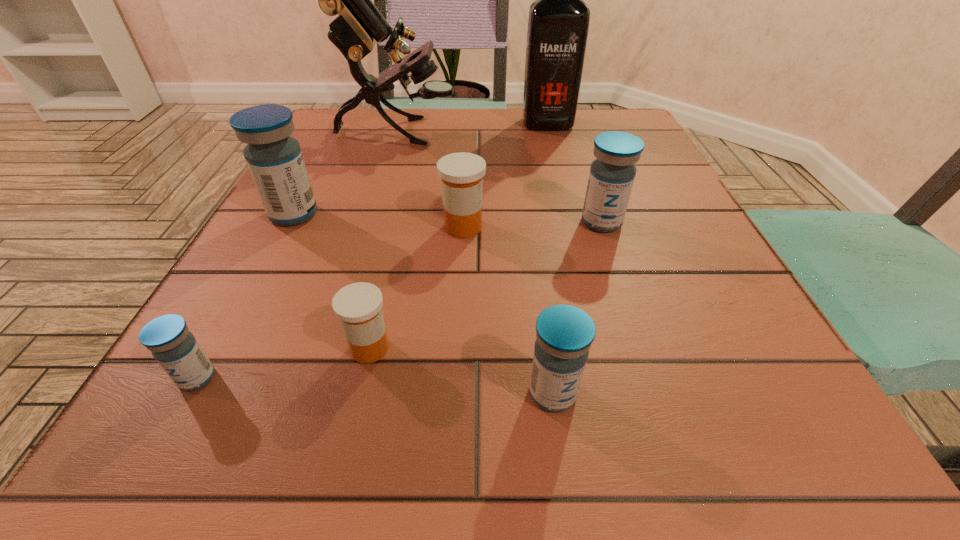
In the image, there is a desktop. At what (x,y) coordinates should I click in order to perform the action: click on vacant space at the near edge. Please return your answer as a coordinate pair (x, y). Looking at the image, I should click on (381, 446).

In order to click on blank space at the left edge of the desktop in this screenshot , I will do click(302, 301).

The image size is (960, 540). In the image, there is a desktop. Identify the location of free space at the right edge. (645, 272).

Where is `free space at the far left corner`? The height and width of the screenshot is (540, 960). free space at the far left corner is located at coordinates (366, 113).

The width and height of the screenshot is (960, 540). I want to click on vacant space at the far right corner of the desktop, so click(x=646, y=138).

I want to click on free space between the microscope and the smallest blue medicine, so pos(297,255).

This screenshot has width=960, height=540. What are the coordinates of `unoccupied position between the second medicine from right to left and the black liquor` in the screenshot? It's located at (550, 258).

Find the location of a particular element. free space between the microscope and the third tallest object is located at coordinates (346, 173).

Where is `free space between the black liquor and the second tallest medicine`? The image size is (960, 540). free space between the black liquor and the second tallest medicine is located at coordinates (574, 173).

Where is `empty location between the biggest blue medicine and the fourth medicine from right to left`? empty location between the biggest blue medicine and the fourth medicine from right to left is located at coordinates (332, 281).